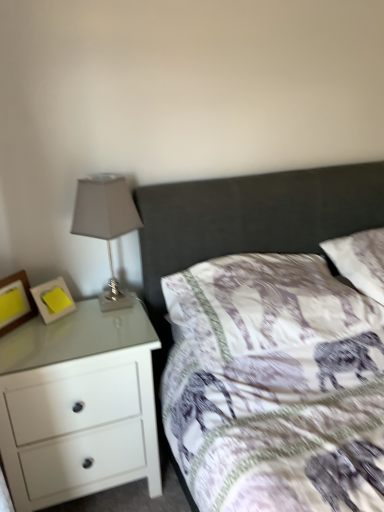
At what (x,y) coordinates should I click in order to perform the action: click on wooden picture frame at left, marked as the first picture frame in a left-to-right arrangement. Please return your answer as a coordinate pair (x, y). Looking at the image, I should click on (22, 298).

The image size is (384, 512). What do you see at coordinates (360, 260) in the screenshot? I see `white soft pillow at upper right, which appears as the second pillow when viewed from the left` at bounding box center [360, 260].

Locate an element on the screen. The image size is (384, 512). white fabric pillow at center, placed as the 2th pillow when sorted from right to left is located at coordinates click(264, 306).

At what (x,y) coordinates should I click in order to perform the action: click on wooden picture frame at left, which is counted as the 2th picture frame, starting from the right. Please return your answer as a coordinate pair (x, y). Image resolution: width=384 pixels, height=512 pixels. Looking at the image, I should click on (22, 298).

Which is behind, point (320, 314) or point (36, 313)?

The point (36, 313) is farther from the camera.

From their relative heights in the image, would you say white fabric pillow at center, the first pillow positioned from the left, is taller or shorter than wooden picture frame at left, which is counted as the 2th picture frame, starting from the right?

Clearly, white fabric pillow at center, the first pillow positioned from the left, is taller compared to wooden picture frame at left, which is counted as the 2th picture frame, starting from the right.

Which is in front, white fabric pillow at center, the first pillow positioned from the left, or wooden picture frame at left, which is counted as the 2th picture frame, starting from the right?

white fabric pillow at center, the first pillow positioned from the left, is in front.

From the image's perspective, between matte gray glass table lamp at left and white fabric pillow at center, placed as the 2th pillow when sorted from right to left, which one is located above?

matte gray glass table lamp at left is shown above in the image.

Can you confirm if matte gray glass table lamp at left is bigger than white fabric pillow at center, the first pillow positioned from the left?

No.

The image size is (384, 512). What are the coordinates of `table lamp that appears above the white fabric pillow at center, the first pillow positioned from the left (from a real-world perspective)` in the screenshot? It's located at (106, 223).

How many degrees apart are the facing directions of matte gray glass table lamp at left and white fabric pillow at center, the first pillow positioned from the left?

There is a 1.46-degree angle between the facing directions of matte gray glass table lamp at left and white fabric pillow at center, the first pillow positioned from the left.

Is white fabric pillow at center, the first pillow positioned from the left, placed right next to yellow paper at left, which is counted as the 2th picture frame, starting from the left?

There is a gap between white fabric pillow at center, the first pillow positioned from the left, and yellow paper at left, which is counted as the 2th picture frame, starting from the left.

Between white fabric pillow at center, placed as the 2th pillow when sorted from right to left, and yellow paper at left, which is counted as the 2th picture frame, starting from the left, which one has more height?

Standing taller between the two is white fabric pillow at center, placed as the 2th pillow when sorted from right to left.

Does white fabric pillow at center, placed as the 2th pillow when sorted from right to left, have a smaller size compared to yellow paper at left, marked as the 1th picture frame in a right-to-left arrangement?

Incorrect, white fabric pillow at center, placed as the 2th pillow when sorted from right to left, is not smaller in size than yellow paper at left, marked as the 1th picture frame in a right-to-left arrangement.

What are the coordinates of `pillow below the white soft pillow at upper right, which appears as the second pillow when viewed from the left (from a real-world perspective)` in the screenshot? It's located at (264, 306).

Based on their positions, is white fabric pillow at center, placed as the 2th pillow when sorted from right to left, located to the left or right of white soft pillow at upper right, acting as the 1th pillow starting from the right?

Clearly, white fabric pillow at center, placed as the 2th pillow when sorted from right to left, is on the left of white soft pillow at upper right, acting as the 1th pillow starting from the right, in the image.

In terms of width, does white fabric pillow at center, the first pillow positioned from the left, look wider or thinner when compared to white soft pillow at upper right, acting as the 1th pillow starting from the right?

Clearly, white fabric pillow at center, the first pillow positioned from the left, has more width compared to white soft pillow at upper right, acting as the 1th pillow starting from the right.

Looking at this image, which is closer, (218,266) or (348,241)?

The point (218,266) is in front.

Would you say white soft pillow at upper right, which appears as the second pillow when viewed from the left, is outside wooden picture frame at left, which is counted as the 2th picture frame, starting from the right?

Absolutely, white soft pillow at upper right, which appears as the second pillow when viewed from the left, is external to wooden picture frame at left, which is counted as the 2th picture frame, starting from the right.

Considering the sizes of objects white soft pillow at upper right, acting as the 1th pillow starting from the right, and wooden picture frame at left, which is counted as the 2th picture frame, starting from the right, in the image provided, who is smaller, white soft pillow at upper right, acting as the 1th pillow starting from the right, or wooden picture frame at left, which is counted as the 2th picture frame, starting from the right,?

With smaller size is wooden picture frame at left, which is counted as the 2th picture frame, starting from the right.

Can you tell me how much white soft pillow at upper right, which appears as the second pillow when viewed from the left, and wooden picture frame at left, marked as the first picture frame in a left-to-right arrangement, differ in facing direction?

They differ by 43 degrees in their facing directions.

From a real-world perspective, which object stands above the other?

In real-world perspective, wooden picture frame at left, marked as the first picture frame in a left-to-right arrangement, is above.

In terms of height, does white glossy chest of drawers at left look taller or shorter compared to yellow paper at left, which is counted as the 2th picture frame, starting from the left?

Clearly, white glossy chest of drawers at left is taller compared to yellow paper at left, which is counted as the 2th picture frame, starting from the left.

From the image's perspective, which one is positioned higher, white glossy chest of drawers at left or yellow paper at left, which is counted as the 2th picture frame, starting from the left?

yellow paper at left, which is counted as the 2th picture frame, starting from the left.

Are white glossy chest of drawers at left and yellow paper at left, marked as the 1th picture frame in a right-to-left arrangement, far apart?

That's not correct — white glossy chest of drawers at left is a little close to yellow paper at left, marked as the 1th picture frame in a right-to-left arrangement.

Does white glossy chest of drawers at left contain yellow paper at left, which is counted as the 2th picture frame, starting from the left?

Actually, yellow paper at left, which is counted as the 2th picture frame, starting from the left, is outside white glossy chest of drawers at left.

In the scene shown: Who is smaller, matte gray glass table lamp at left or white soft pillow at upper right, which appears as the second pillow when viewed from the left?

Smaller between the two is matte gray glass table lamp at left.

Does matte gray glass table lamp at left turn towards white soft pillow at upper right, acting as the 1th pillow starting from the right?

No, matte gray glass table lamp at left is not oriented towards white soft pillow at upper right, acting as the 1th pillow starting from the right.

Relative to white soft pillow at upper right, which appears as the second pillow when viewed from the left, is matte gray glass table lamp at left in front or behind?

In the image, matte gray glass table lamp at left appears in front of white soft pillow at upper right, which appears as the second pillow when viewed from the left.

Is matte gray glass table lamp at left not near white soft pillow at upper right, which appears as the second pillow when viewed from the left?

No, matte gray glass table lamp at left is not far away from white soft pillow at upper right, which appears as the second pillow when viewed from the left.

Where is `the 2nd picture frame to the left of the white fabric pillow at center, the first pillow positioned from the left, counting from the anchor's position`? This screenshot has height=512, width=384. the 2nd picture frame to the left of the white fabric pillow at center, the first pillow positioned from the left, counting from the anchor's position is located at coordinates (22, 298).

At what (x,y) coordinates should I click in order to perform the action: click on the 2nd pillow below the matte gray glass table lamp at left (from the image's perspective). Please return your answer as a coordinate pair (x, y). The image size is (384, 512). Looking at the image, I should click on (264, 306).

Looking at the image, which one is located closer to white fabric pillow at center, the first pillow positioned from the left, yellow paper at left, marked as the 1th picture frame in a right-to-left arrangement, or white soft pillow at upper right, which appears as the second pillow when viewed from the left?

white soft pillow at upper right, which appears as the second pillow when viewed from the left, is positioned closer to the anchor white fabric pillow at center, the first pillow positioned from the left.

Based on their spatial positions, is white soft pillow at upper right, which appears as the second pillow when viewed from the left, or white glossy chest of drawers at left closer to white fabric pillow at center, the first pillow positioned from the left?

white soft pillow at upper right, which appears as the second pillow when viewed from the left, lies closer to white fabric pillow at center, the first pillow positioned from the left, than the other object.

From the image, which object appears to be nearer to yellow paper at left, marked as the 1th picture frame in a right-to-left arrangement, wooden picture frame at left, which is counted as the 2th picture frame, starting from the right, or white glossy chest of drawers at left?

Among the two, wooden picture frame at left, which is counted as the 2th picture frame, starting from the right, is located nearer to yellow paper at left, marked as the 1th picture frame in a right-to-left arrangement.

Looking at the image, which one is located further to white glossy chest of drawers at left, white soft pillow at upper right, acting as the 1th pillow starting from the right, or yellow paper at left, marked as the 1th picture frame in a right-to-left arrangement?

white soft pillow at upper right, acting as the 1th pillow starting from the right, is further to white glossy chest of drawers at left.

When comparing their distances from yellow paper at left, which is counted as the 2th picture frame, starting from the left, does matte gray glass table lamp at left or white glossy chest of drawers at left seem further?

white glossy chest of drawers at left is positioned further to the anchor yellow paper at left, which is counted as the 2th picture frame, starting from the left.

Looking at the image, which one is located further to white soft pillow at upper right, acting as the 1th pillow starting from the right, wooden picture frame at left, which is counted as the 2th picture frame, starting from the right, or white fabric pillow at center, the first pillow positioned from the left?

wooden picture frame at left, which is counted as the 2th picture frame, starting from the right.

When comparing their distances from matte gray glass table lamp at left, does white fabric pillow at center, placed as the 2th pillow when sorted from right to left, or white glossy chest of drawers at left seem further?

white fabric pillow at center, placed as the 2th pillow when sorted from right to left.

Looking at this image, looking at the image, which one is located further to yellow paper at left, which is counted as the 2th picture frame, starting from the left, white fabric pillow at center, placed as the 2th pillow when sorted from right to left, or white soft pillow at upper right, which appears as the second pillow when viewed from the left?

white soft pillow at upper right, which appears as the second pillow when viewed from the left.

Locate an element on the screen. This screenshot has width=384, height=512. picture frame between wooden picture frame at left, marked as the first picture frame in a left-to-right arrangement, and white fabric pillow at center, the first pillow positioned from the left, from left to right is located at coordinates (53, 298).

This screenshot has width=384, height=512. Find the location of `picture frame situated between wooden picture frame at left, which is counted as the 2th picture frame, starting from the right, and matte gray glass table lamp at left from left to right`. picture frame situated between wooden picture frame at left, which is counted as the 2th picture frame, starting from the right, and matte gray glass table lamp at left from left to right is located at coordinates (53, 298).

This screenshot has height=512, width=384. In order to click on picture frame between wooden picture frame at left, marked as the first picture frame in a left-to-right arrangement, and white soft pillow at upper right, acting as the 1th pillow starting from the right in this screenshot , I will do `click(53, 298)`.

What are the coordinates of `table lamp located between wooden picture frame at left, which is counted as the 2th picture frame, starting from the right, and white soft pillow at upper right, which appears as the second pillow when viewed from the left, in the left-right direction` in the screenshot? It's located at (106, 223).